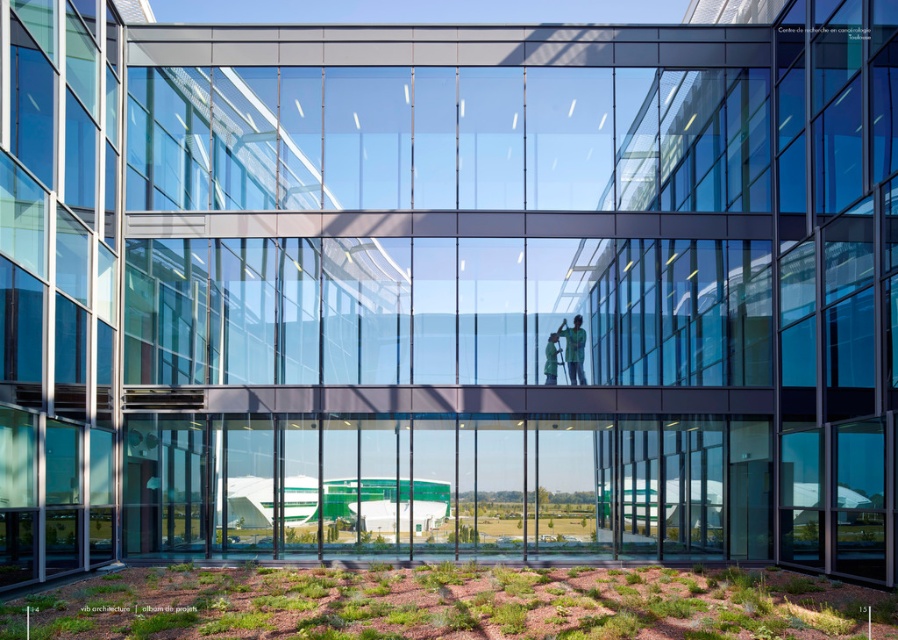
Can you confirm if green fabric person at center is positioned to the left of green fabric at center?

In fact, green fabric person at center is to the right of green fabric at center.

Can you confirm if green fabric person at center is taller than green fabric at center?

Indeed, green fabric person at center has a greater height compared to green fabric at center.

Is point (577, 316) positioned after point (553, 374)?

Yes.

Image resolution: width=898 pixels, height=640 pixels. I want to click on green fabric person at center, so click(x=573, y=348).